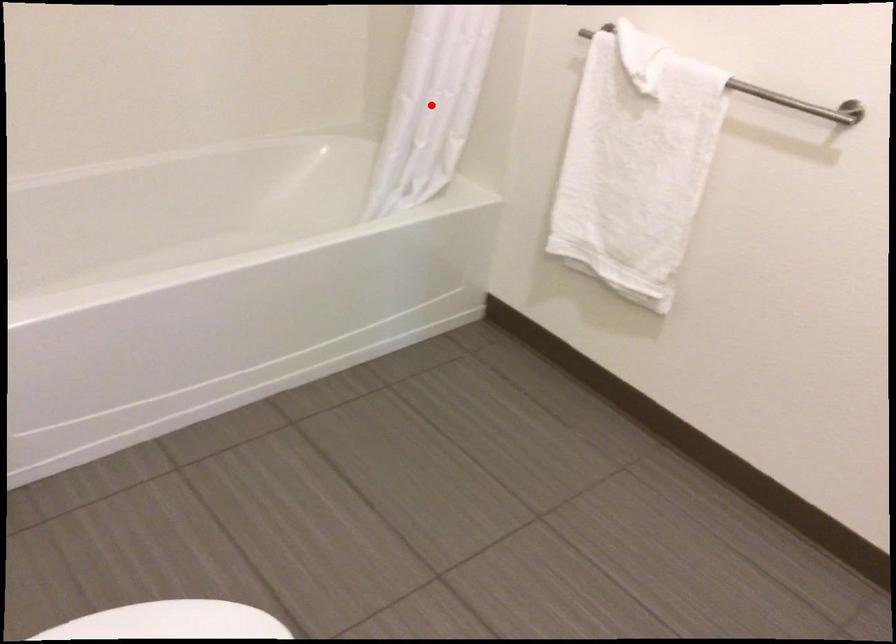
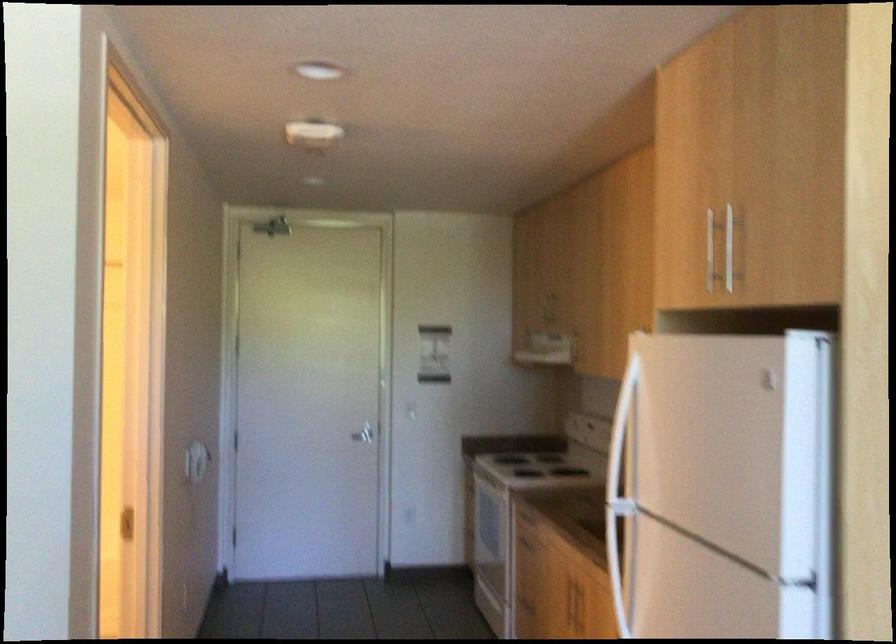
Question: I am providing you with two images of the same scene from different viewpoints. A red point is marked on the first image. Is the red point's position out of view in image 2?

Choices:
 (A) Yes
 (B) No

Answer: (A)